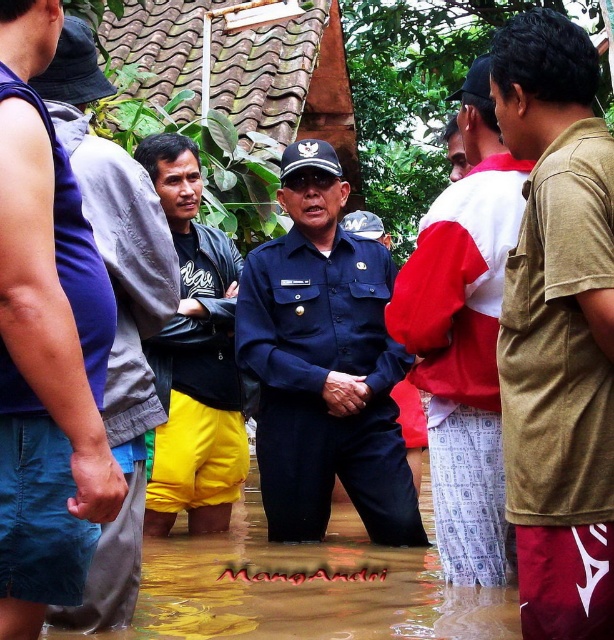
Question: Which object appears farthest from the camera in this image?

Choices:
 (A) yellow shorts at left
 (B) brown cotton shirt at right

Answer: (A)

Question: Which object appears closest to the camera in this image?

Choices:
 (A) yellow shorts at left
 (B) yellow shorts at center
 (C) navy blue uniform at center
 (D) red and white shirt at center

Answer: (A)

Question: Is navy blue uniform at center closer to the viewer compared to red and white shirt at center?

Choices:
 (A) no
 (B) yes

Answer: (A)

Question: Does red and white shirt at center appear on the left side of yellow shorts at left?

Choices:
 (A) yes
 (B) no

Answer: (B)

Question: Can you confirm if brown cotton shirt at right is smaller than navy blue uniform at center?

Choices:
 (A) no
 (B) yes

Answer: (B)

Question: Which of these objects is positioned closest to the brown cotton shirt at right?

Choices:
 (A) yellow shorts at center
 (B) red and white shirt at center
 (C) yellow shorts at left

Answer: (B)